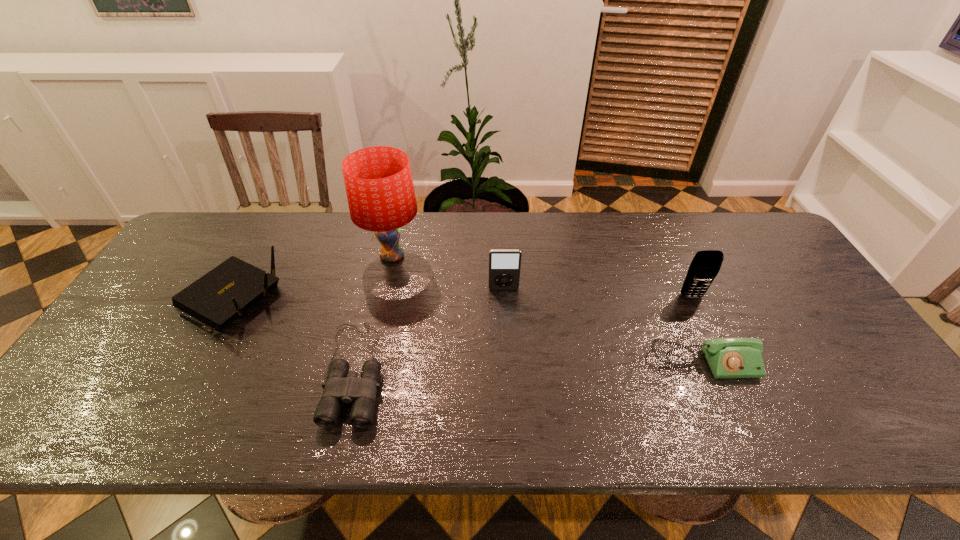
Identify the location of object that is the third closest one to the telephone. (342, 386).